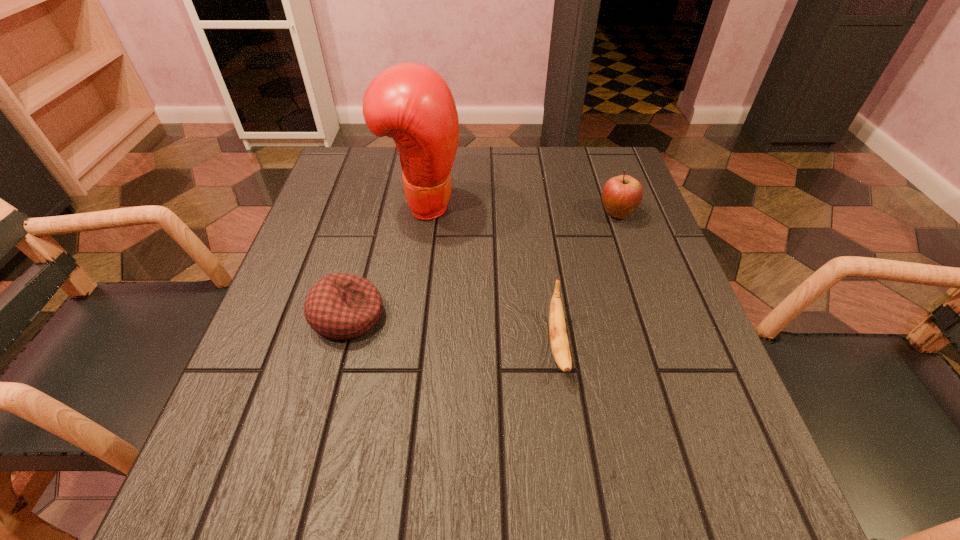
The height and width of the screenshot is (540, 960). In order to click on the tallest object in this screenshot , I will do `click(410, 102)`.

I want to click on the rightmost object, so click(x=621, y=195).

This screenshot has width=960, height=540. What are the coordinates of `the second tallest object` in the screenshot? It's located at (621, 195).

Where is `banana`? This screenshot has height=540, width=960. banana is located at coordinates (557, 328).

This screenshot has width=960, height=540. In order to click on beanbag in this screenshot , I will do `click(341, 306)`.

At what (x,y) coordinates should I click in order to perform the action: click on vacant space located 0.320m on the striking surface of the boxing glove. Please return your answer as a coordinate pair (x, y). This screenshot has width=960, height=540. Looking at the image, I should click on (595, 204).

Find the location of a particular element. The width and height of the screenshot is (960, 540). vacant space located 0.080m on the left of the second tallest object is located at coordinates (564, 214).

At what (x,y) coordinates should I click in order to perform the action: click on vacant region located 0.150m on the peel of the banana from the top. Please return your answer as a coordinate pair (x, y). Image resolution: width=960 pixels, height=540 pixels. Looking at the image, I should click on (578, 482).

Image resolution: width=960 pixels, height=540 pixels. Find the location of `free space located on the right of the beanbag`. free space located on the right of the beanbag is located at coordinates [411, 316].

Where is `object present at the far edge`? Image resolution: width=960 pixels, height=540 pixels. object present at the far edge is located at coordinates (410, 102).